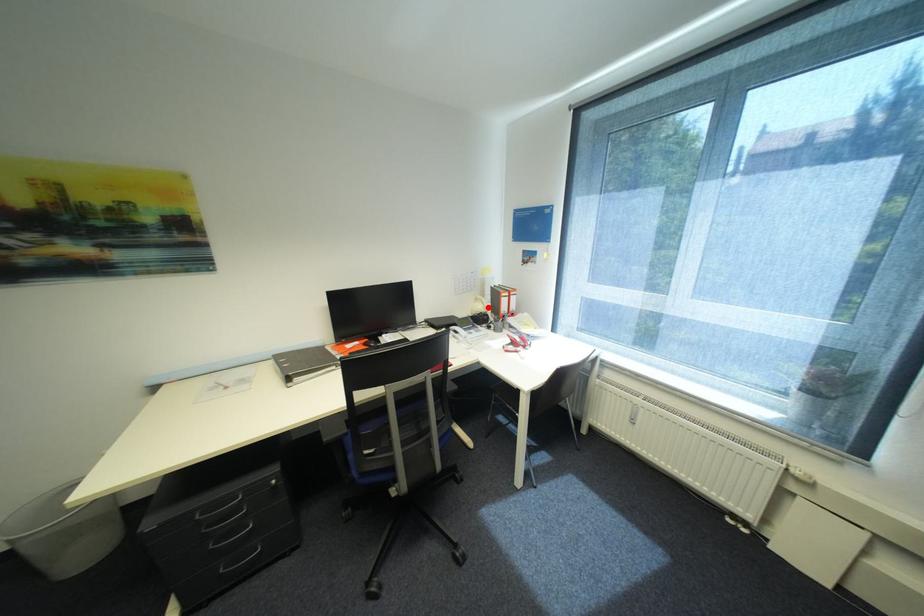
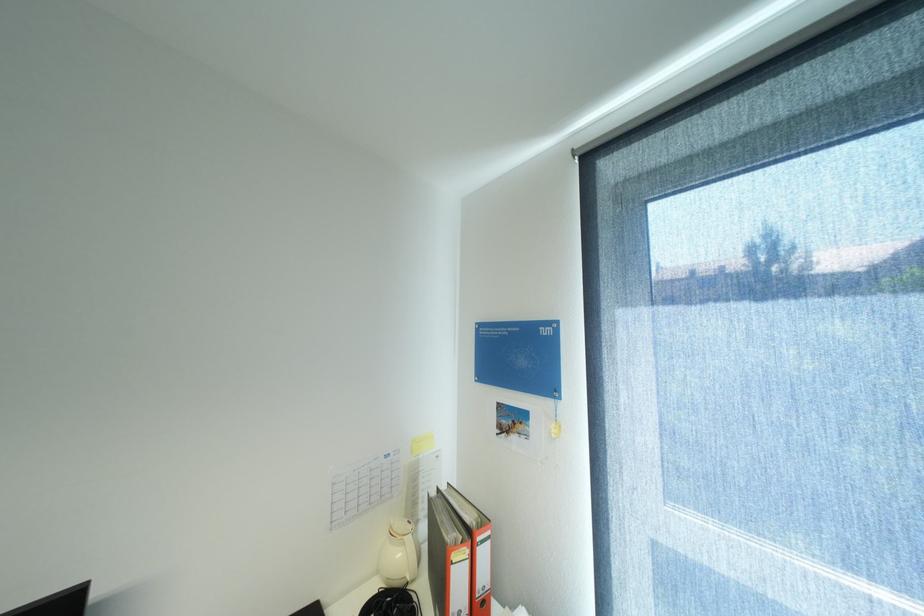
Where in the second image is the point corresponding to the highlighted location from the first image?

(407, 554)